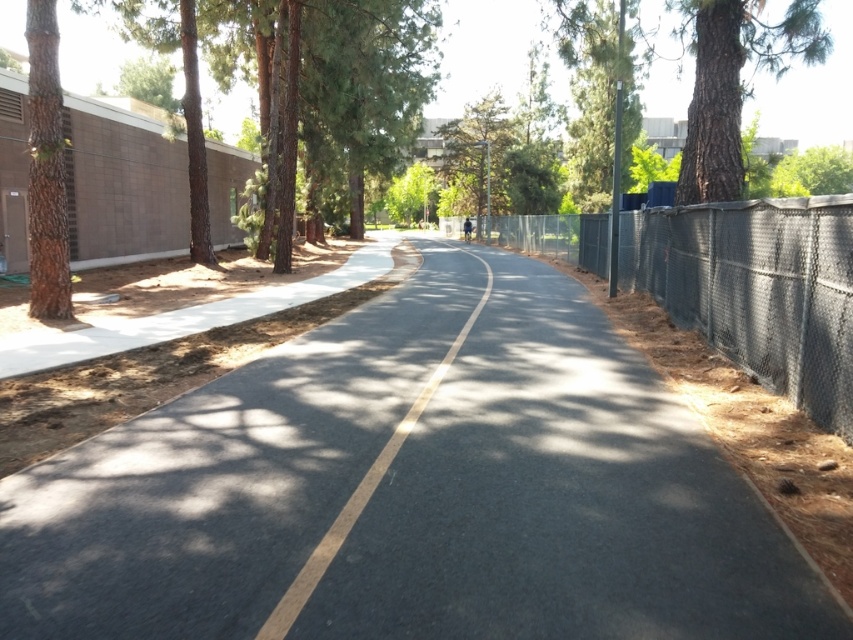
Which is behind, point (341, 387) or point (39, 77)?

Positioned behind is point (39, 77).

Is asphalt at center behind brown rough bark tree at left?

No, asphalt at center is closer to the viewer.

At what (x,y) coordinates should I click in order to perform the action: click on asphalt at center. Please return your answer as a coordinate pair (x, y). Image resolution: width=853 pixels, height=640 pixels. Looking at the image, I should click on (412, 490).

Locate an element on the screen. The height and width of the screenshot is (640, 853). asphalt at center is located at coordinates (412, 490).

Does black asphalt road at center have a greater height compared to green leafy tree at center?

In fact, black asphalt road at center may be shorter than green leafy tree at center.

Which is more to the right, black asphalt road at center or green leafy tree at center?

green leafy tree at center

This screenshot has height=640, width=853. Find the location of `black asphalt road at center`. black asphalt road at center is located at coordinates (363, 490).

How far apart are brown rough bark tree at left and black asphalt road at center?

brown rough bark tree at left and black asphalt road at center are 4.90 meters apart from each other.

Who is more distant from viewer, (x=44, y=100) or (x=403, y=432)?

Point (x=44, y=100)

Locate an element on the screen. Image resolution: width=853 pixels, height=640 pixels. brown rough bark tree at left is located at coordinates (45, 170).